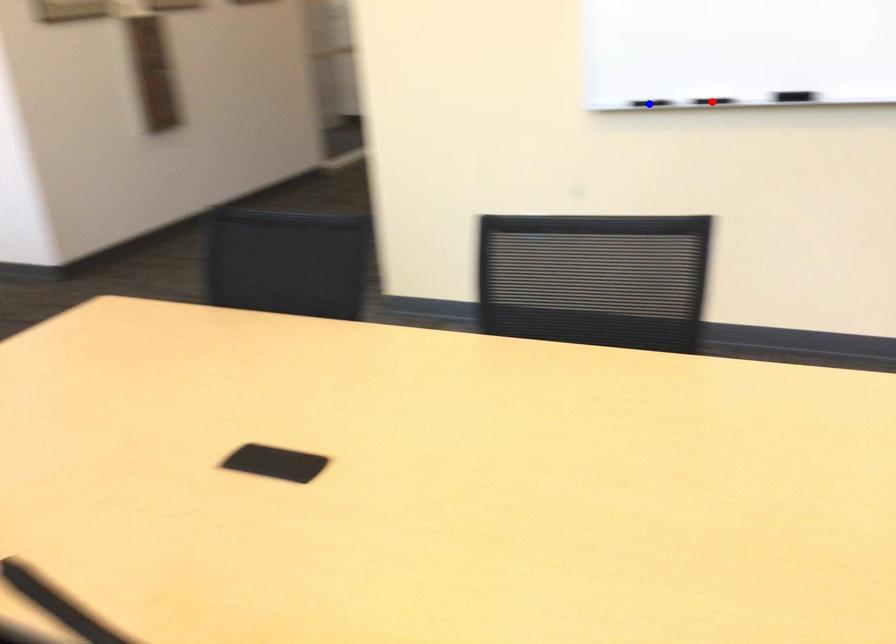
Question: Which of the two points in the image is closer to the camera?

Choices:
 (A) Blue point is closer.
 (B) Red point is closer.

Answer: (B)